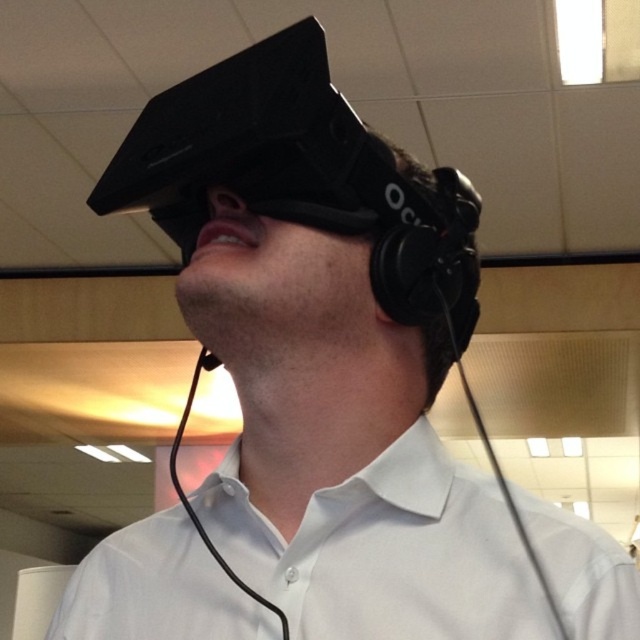
Is point (573, 602) closer to camera compared to point (209, 365)?

Yes.

Does white cotton dress shirt at center have a larger size compared to black matte earphone at upper center?

Yes, white cotton dress shirt at center is bigger than black matte earphone at upper center.

Which is behind, point (440, 456) or point (202, 355)?

The point (202, 355) is behind.

Locate an element on the screen. The width and height of the screenshot is (640, 640). white cotton dress shirt at center is located at coordinates (385, 550).